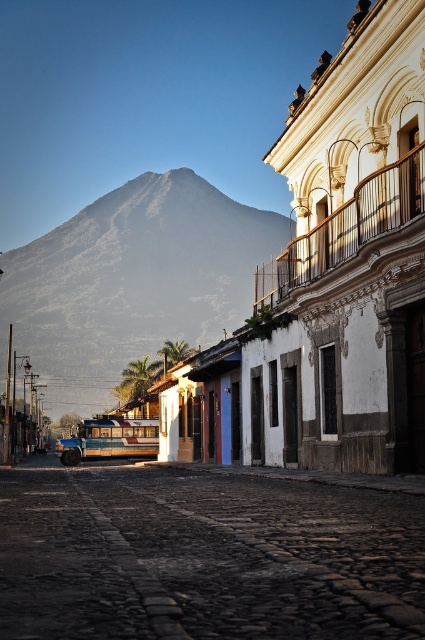
Is cobblestone street at center smaller than wooden painted bus at center?

Indeed, cobblestone street at center has a smaller size compared to wooden painted bus at center.

Which is in front, point (359, 563) or point (74, 458)?

Point (359, 563) is more forward.

Locate an element on the screen. cobblestone street at center is located at coordinates (207, 554).

Is point (260, 508) positioned in front of point (200, 269)?

That is True.

Which of these two, cobblestone street at center or gray rocky mountain at upper left, stands shorter?

cobblestone street at center

In order to click on cobblestone street at center in this screenshot , I will do `click(207, 554)`.

From the picture: Can you confirm if gray rocky mountain at upper left is positioned below wooden painted bus at center?

Incorrect, gray rocky mountain at upper left is not positioned below wooden painted bus at center.

Does gray rocky mountain at upper left appear on the left side of wooden painted bus at center?

Indeed, gray rocky mountain at upper left is positioned on the left side of wooden painted bus at center.

Between point (82, 381) and point (113, 451), which one is positioned in front?

Point (113, 451) is in front.

At what (x,y) coordinates should I click in order to perform the action: click on gray rocky mountain at upper left. Please return your answer as a coordinate pair (x, y). This screenshot has height=640, width=425. Looking at the image, I should click on (132, 282).